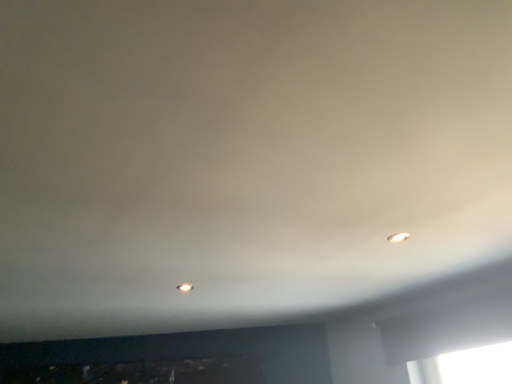
Measure the distance between point (402, 232) and camera.

The depth of point (402, 232) is 6.09 feet.

This screenshot has height=384, width=512. What do you see at coordinates (398, 237) in the screenshot?
I see `matte white light fixture at upper right` at bounding box center [398, 237].

The image size is (512, 384). I want to click on matte white light fixture at upper right, so click(398, 237).

Image resolution: width=512 pixels, height=384 pixels. Find the location of `matte white light fixture at upper right`. matte white light fixture at upper right is located at coordinates click(x=398, y=237).